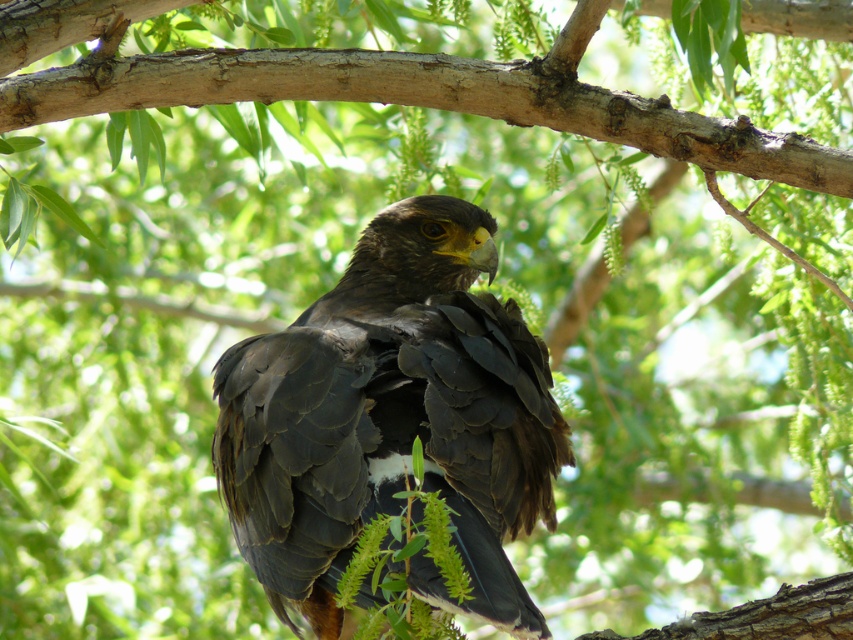
Which is more to the left, dark brown feathers at center or smooth brown branch at center?

dark brown feathers at center is more to the left.

Which is more to the right, dark brown feathers at center or smooth brown branch at center?

smooth brown branch at center

You are a GUI agent. You are given a task and a screenshot of the screen. Output one action in this format:
    pyautogui.click(x=<x>, y=<y>)
    Task: Click on the dark brown feathers at center
    
    Given the screenshot: What is the action you would take?
    pyautogui.click(x=392, y=419)

You are a GUI agent. You are given a task and a screenshot of the screen. Output one action in this format:
    pyautogui.click(x=<x>, y=<y>)
    Task: Click on the dark brown feathers at center
    
    Given the screenshot: What is the action you would take?
    pyautogui.click(x=392, y=419)